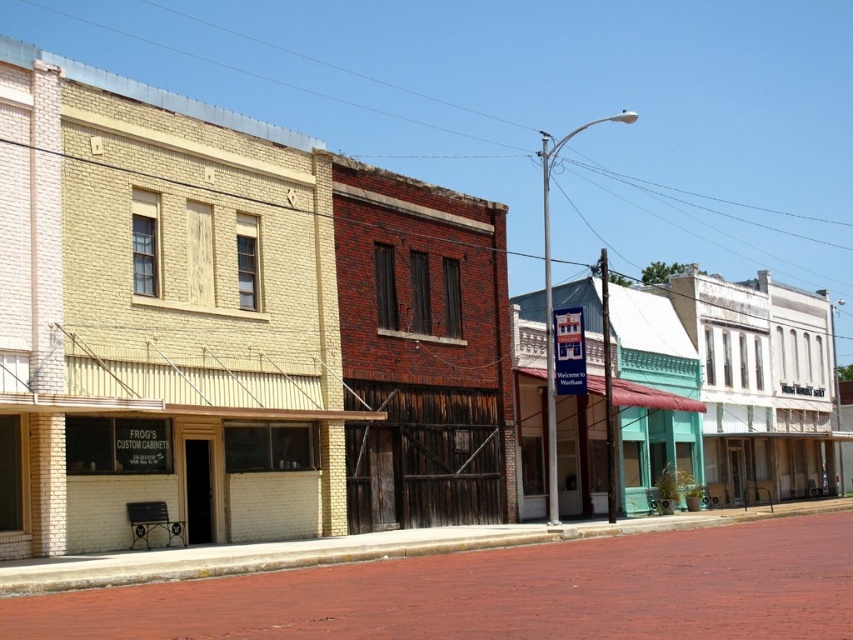
Which is more to the right, white wooden storefront at center or green painted wood storefront at center?

white wooden storefront at center is more to the right.

Where is `white wooden storefront at center`? white wooden storefront at center is located at coordinates point(769,465).

Is point (711, 452) closer to viewer compared to point (650, 396)?

No, (711, 452) is further to viewer.

Where is `white wooden storefront at center`? This screenshot has height=640, width=853. white wooden storefront at center is located at coordinates (769, 465).